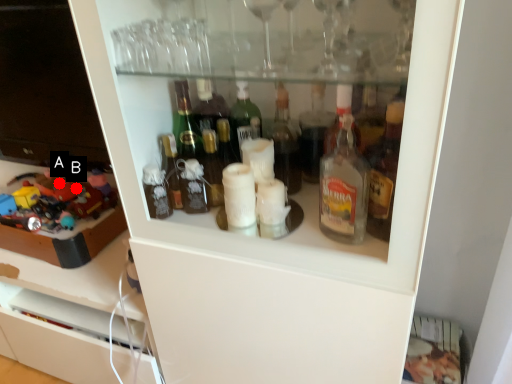
Question: Two points are circled on the image, labeled by A and B beside each circle. Among these points, which one is farthest from the camera?

Choices:
 (A) A is further
 (B) B is further

Answer: (A)